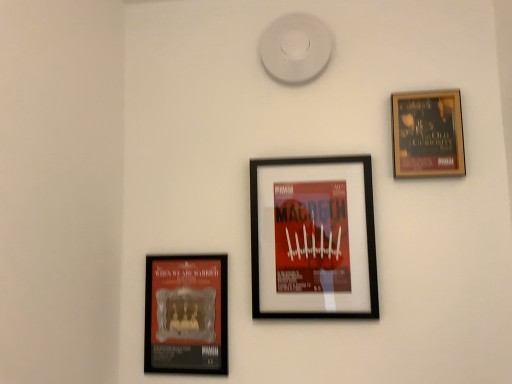
In the scene shown: Measure the distance between black matte picture frame at center, arranged as the second picture frame when viewed from the left, and camera.

1.12 meters.

What do you see at coordinates (186, 315) in the screenshot?
I see `matte black poster at lower left, arranged as the first picture frame when viewed from the left` at bounding box center [186, 315].

This screenshot has width=512, height=384. What are the coordinates of `wooden framed poster at upper right, the third picture frame viewed from the left` in the screenshot? It's located at (426, 134).

At what (x,y) coordinates should I click in order to perform the action: click on black matte picture frame at center, arranged as the second picture frame when viewed from the left. Please return your answer as a coordinate pair (x, y). Looking at the image, I should click on (313, 238).

Find the location of `picture frame that is the 2nd object located below the wooden framed poster at upper right, which is the 1th picture frame from right to left (from the image's perspective)`. picture frame that is the 2nd object located below the wooden framed poster at upper right, which is the 1th picture frame from right to left (from the image's perspective) is located at coordinates (186, 315).

Is matte black poster at lower left, the 3th picture frame viewed from the right, inside or outside of wooden framed poster at upper right, which is the 1th picture frame from right to left?

The correct answer is: outside.

Who is taller, matte black poster at lower left, the 3th picture frame viewed from the right, or wooden framed poster at upper right, the third picture frame viewed from the left?

With more height is matte black poster at lower left, the 3th picture frame viewed from the right.

From a real-world perspective, which object rests below the other?

black matte picture frame at center, the 2th picture frame positioned from the right, from a real-world perspective.

Consider the image. Looking at the image, does wooden framed poster at upper right, which is the 1th picture frame from right to left, seem bigger or smaller compared to black matte picture frame at center, the 2th picture frame positioned from the right?

wooden framed poster at upper right, which is the 1th picture frame from right to left, is smaller than black matte picture frame at center, the 2th picture frame positioned from the right.

Is black matte picture frame at center, the 2th picture frame positioned from the right, directly adjacent to matte black poster at lower left, arranged as the first picture frame when viewed from the left?

black matte picture frame at center, the 2th picture frame positioned from the right, and matte black poster at lower left, arranged as the first picture frame when viewed from the left, are clearly separated.

Between black matte picture frame at center, arranged as the second picture frame when viewed from the left, and matte black poster at lower left, the 3th picture frame viewed from the right, which one appears on the left side from the viewer's perspective?

matte black poster at lower left, the 3th picture frame viewed from the right, is more to the left.

From a real-world perspective, between black matte picture frame at center, arranged as the second picture frame when viewed from the left, and matte black poster at lower left, the 3th picture frame viewed from the right, who is vertically lower?

In real-world perspective, matte black poster at lower left, the 3th picture frame viewed from the right, is lower.

Is black matte picture frame at center, the 2th picture frame positioned from the right, behind matte black poster at lower left, arranged as the first picture frame when viewed from the left?

That is False.

Based on their positions, is wooden framed poster at upper right, which is the 1th picture frame from right to left, located to the left or right of matte black poster at lower left, arranged as the first picture frame when viewed from the left?

Based on their positions, wooden framed poster at upper right, which is the 1th picture frame from right to left, is located to the right of matte black poster at lower left, arranged as the first picture frame when viewed from the left.

Considering the points (412, 104) and (216, 301), which point is behind, point (412, 104) or point (216, 301)?

The point (216, 301) is farther.

Does wooden framed poster at upper right, which is the 1th picture frame from right to left, contain matte black poster at lower left, the 3th picture frame viewed from the right?

No, matte black poster at lower left, the 3th picture frame viewed from the right, is located outside of wooden framed poster at upper right, which is the 1th picture frame from right to left.

The height and width of the screenshot is (384, 512). Find the location of `the 2nd picture frame located beneath the wooden framed poster at upper right, which is the 1th picture frame from right to left (from a real-world perspective)`. the 2nd picture frame located beneath the wooden framed poster at upper right, which is the 1th picture frame from right to left (from a real-world perspective) is located at coordinates (186, 315).

Is black matte picture frame at center, the 2th picture frame positioned from the right, inside matte black poster at lower left, the 3th picture frame viewed from the right?

No.

Does matte black poster at lower left, the 3th picture frame viewed from the right, come behind black matte picture frame at center, arranged as the second picture frame when viewed from the left?

Yes, matte black poster at lower left, the 3th picture frame viewed from the right, is behind black matte picture frame at center, arranged as the second picture frame when viewed from the left.

How far apart are matte black poster at lower left, the 3th picture frame viewed from the right, and black matte picture frame at center, arranged as the second picture frame when viewed from the left?

matte black poster at lower left, the 3th picture frame viewed from the right, is 10.16 inches away from black matte picture frame at center, arranged as the second picture frame when viewed from the left.

Is matte black poster at lower left, the 3th picture frame viewed from the right, bigger or smaller than black matte picture frame at center, arranged as the second picture frame when viewed from the left?

matte black poster at lower left, the 3th picture frame viewed from the right, is smaller than black matte picture frame at center, arranged as the second picture frame when viewed from the left.

Between black matte picture frame at center, arranged as the second picture frame when viewed from the left, and wooden framed poster at upper right, which is the 1th picture frame from right to left, which one has larger width?

black matte picture frame at center, arranged as the second picture frame when viewed from the left.

Considering the relative positions of black matte picture frame at center, arranged as the second picture frame when viewed from the left, and wooden framed poster at upper right, the third picture frame viewed from the left, in the image provided, is black matte picture frame at center, arranged as the second picture frame when viewed from the left, to the right of wooden framed poster at upper right, the third picture frame viewed from the left, from the viewer's perspective?

No.

From a real-world perspective, who is located lower, black matte picture frame at center, the 2th picture frame positioned from the right, or wooden framed poster at upper right, the third picture frame viewed from the left?

black matte picture frame at center, the 2th picture frame positioned from the right, is physically lower.

From the image's perspective, which is above, black matte picture frame at center, arranged as the second picture frame when viewed from the left, or wooden framed poster at upper right, the third picture frame viewed from the left?

wooden framed poster at upper right, the third picture frame viewed from the left, is shown above in the image.

At what (x,y) coordinates should I click in order to perform the action: click on picture frame behind the wooden framed poster at upper right, the third picture frame viewed from the left. Please return your answer as a coordinate pair (x, y). This screenshot has height=384, width=512. Looking at the image, I should click on (186, 315).

I want to click on picture frame on the right of black matte picture frame at center, the 2th picture frame positioned from the right, so point(426,134).

When comparing their distances from matte black poster at lower left, arranged as the first picture frame when viewed from the left, does black matte picture frame at center, arranged as the second picture frame when viewed from the left, or wooden framed poster at upper right, which is the 1th picture frame from right to left, seem further?

wooden framed poster at upper right, which is the 1th picture frame from right to left.

Based on the photo, which object lies further to the anchor point wooden framed poster at upper right, the third picture frame viewed from the left, black matte picture frame at center, the 2th picture frame positioned from the right, or matte black poster at lower left, the 3th picture frame viewed from the right?

Among the two, matte black poster at lower left, the 3th picture frame viewed from the right, is located further to wooden framed poster at upper right, the third picture frame viewed from the left.

Consider the image. Based on their spatial positions, is matte black poster at lower left, the 3th picture frame viewed from the right, or wooden framed poster at upper right, the third picture frame viewed from the left, closer to black matte picture frame at center, the 2th picture frame positioned from the right?

matte black poster at lower left, the 3th picture frame viewed from the right, is closer to black matte picture frame at center, the 2th picture frame positioned from the right.

From the picture: Estimate the real-world distances between objects in this image. Which object is further from matte black poster at lower left, arranged as the first picture frame when viewed from the left, wooden framed poster at upper right, which is the 1th picture frame from right to left, or black matte picture frame at center, the 2th picture frame positioned from the right?

wooden framed poster at upper right, which is the 1th picture frame from right to left, is further to matte black poster at lower left, arranged as the first picture frame when viewed from the left.

Estimate the real-world distances between objects in this image. Which object is closer to black matte picture frame at center, arranged as the second picture frame when viewed from the left, wooden framed poster at upper right, the third picture frame viewed from the left, or matte black poster at lower left, the 3th picture frame viewed from the right?

Among the two, matte black poster at lower left, the 3th picture frame viewed from the right, is located nearer to black matte picture frame at center, arranged as the second picture frame when viewed from the left.

Which object lies further to the anchor point wooden framed poster at upper right, the third picture frame viewed from the left, matte black poster at lower left, arranged as the first picture frame when viewed from the left, or black matte picture frame at center, the 2th picture frame positioned from the right?

Among the two, matte black poster at lower left, arranged as the first picture frame when viewed from the left, is located further to wooden framed poster at upper right, the third picture frame viewed from the left.

Image resolution: width=512 pixels, height=384 pixels. In order to click on picture frame situated between matte black poster at lower left, the 3th picture frame viewed from the right, and wooden framed poster at upper right, the third picture frame viewed from the left, from left to right in this screenshot , I will do `click(313, 238)`.